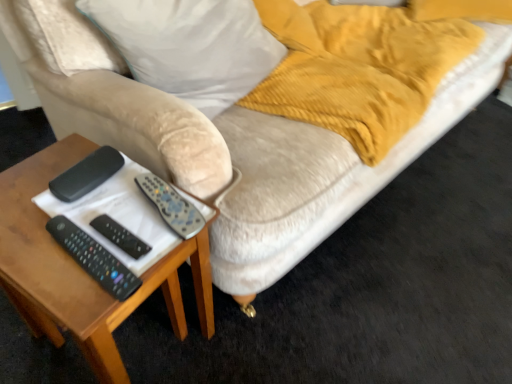
Locate an element on the screen. vacant region below wooden table at lower left (from a real-world perspective) is located at coordinates (136, 342).